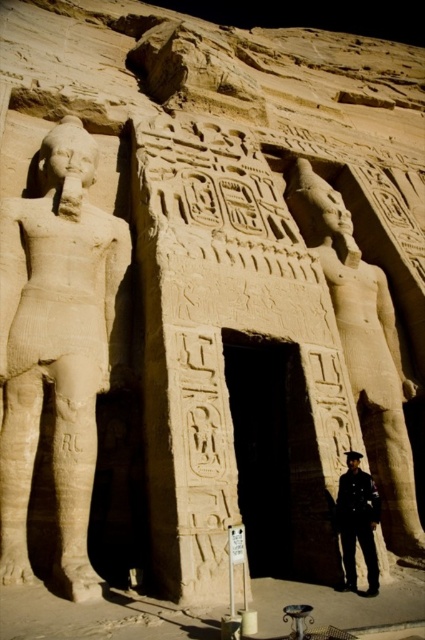
Is polished stone statue at center wider than dark blue uniform at center?

Indeed, polished stone statue at center has a greater width compared to dark blue uniform at center.

Locate an element on the screen. This screenshot has width=425, height=640. polished stone statue at center is located at coordinates (363, 348).

Who is more distant from viewer, (340, 337) or (339, 529)?

The point (340, 337) is behind.

The image size is (425, 640). Identify the location of polished stone statue at center. (363, 348).

Is beige stone statue at left below polished stone statue at center?

Actually, beige stone statue at left is above polished stone statue at center.

Measure the distance between point (x=84, y=376) and camera.

The distance of point (x=84, y=376) from camera is 51.05 meters.

Where is `beige stone statue at left`? beige stone statue at left is located at coordinates (57, 348).

Is point (10, 492) in front of point (365, 563)?

Yes, it is.

Is beige stone statue at left smaller than dark blue uniform at center?

No, beige stone statue at left is not smaller than dark blue uniform at center.

Who is more distant from viewer, (45, 195) or (343, 486)?

The point (45, 195) is more distant.

Image resolution: width=425 pixels, height=640 pixels. In order to click on beige stone statue at left in this screenshot , I will do (57, 348).